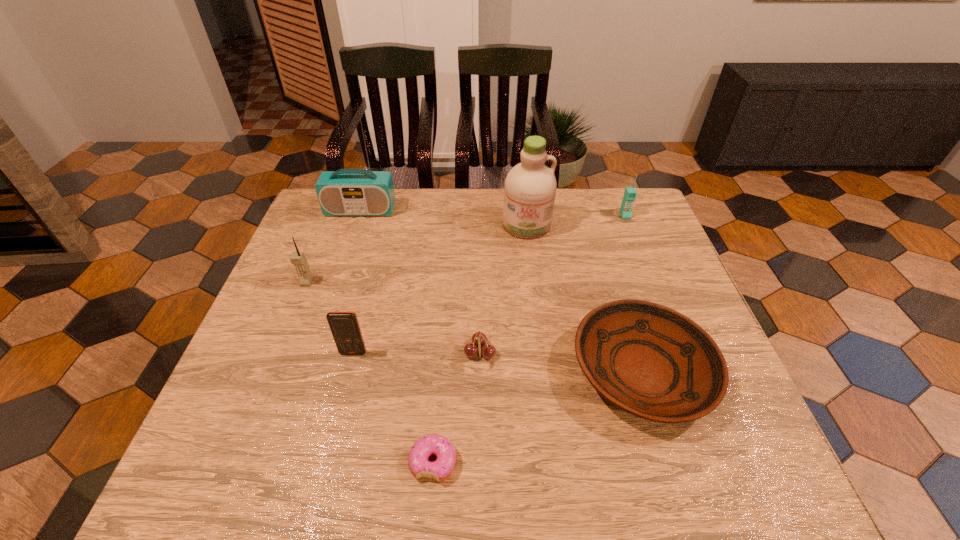
Identify the location of free space that satisfies the following two spatial constraints: 1. on the screen of the second cellular telephone from left to right; 2. on the left side of the fourth object from left to right. The height and width of the screenshot is (540, 960). (325, 462).